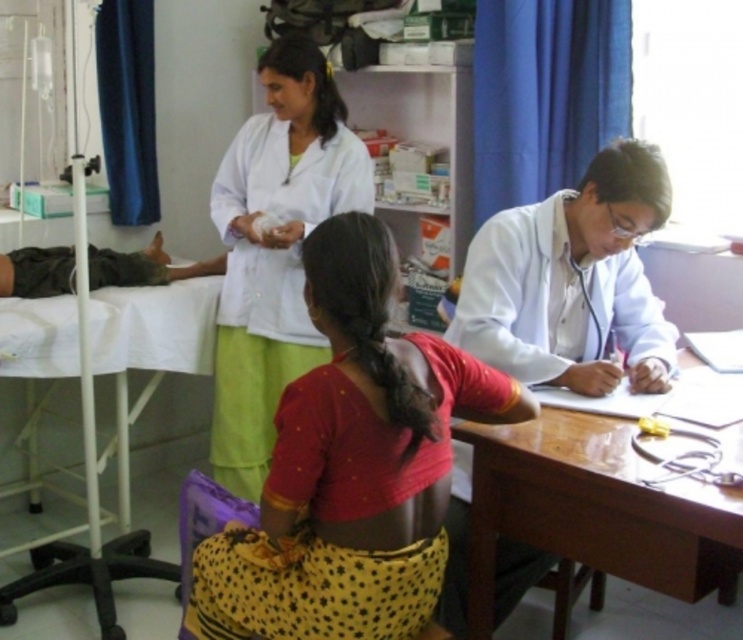
You are a nurse in the clinic and need to locate both the red cotton saree at center and the white glossy coat at center. Which one is positioned to the left when viewed from the front?

The red cotton saree at center is to the left of the white glossy coat at center.

You are a nurse in a clinic and need to store the red cotton saree at center and the white smooth coat at upper center in a locker. The locker has limited space. Based on their sizes, which item should you place first to maximize space efficiency?

The red cotton saree at center occupies less space than the white smooth coat at upper center, so you should place the white smooth coat at upper center first to maximize space efficiency.

You are a medical student who needs to access both the red cotton saree at center and the white smooth coat at upper center during a procedure. Which item will you need to reach for first based on their positions?

The red cotton saree at center is closer to the viewer than the white smooth coat at upper center, so you should reach for the red cotton saree at center first.